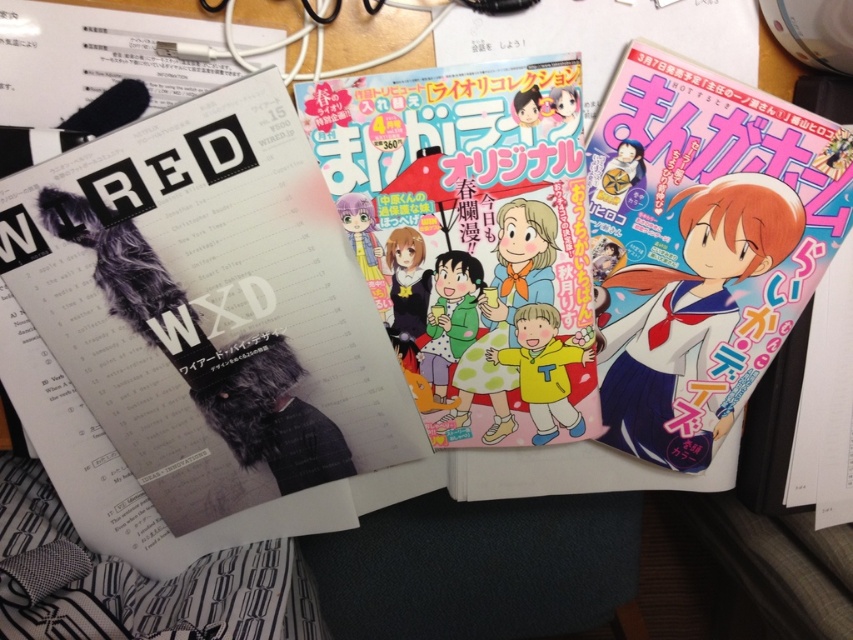
You are a person with a 12 inch long ruler. You want to measure the distance between the pastel matte manga at center and yourself. Can your ruler reach that distance?

The distance between the pastel matte manga at center and the viewer is 19.32 inches. Since your ruler is only 12 inches long, it cannot reach the full distance. You will need a longer ruler.

You are looking at a desk with two points marked on it. The first point is at coordinates point (357, 228) and the second is at point (747, 353). Which of these points is closer to you?

Point (357, 228) is closer to the viewer than point (747, 353).